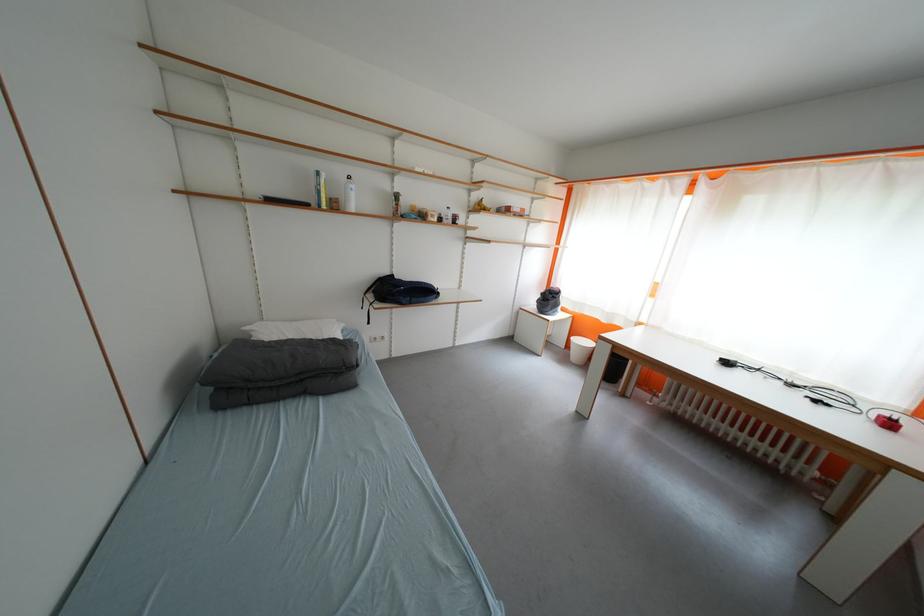
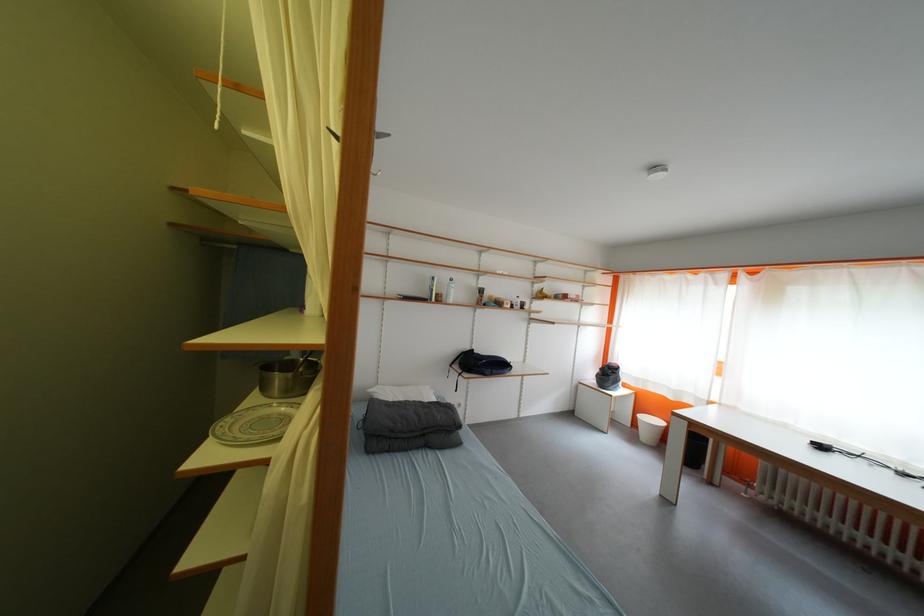
Locate, in the second image, the point that corresponds to (551,297) in the first image.

(610, 371)